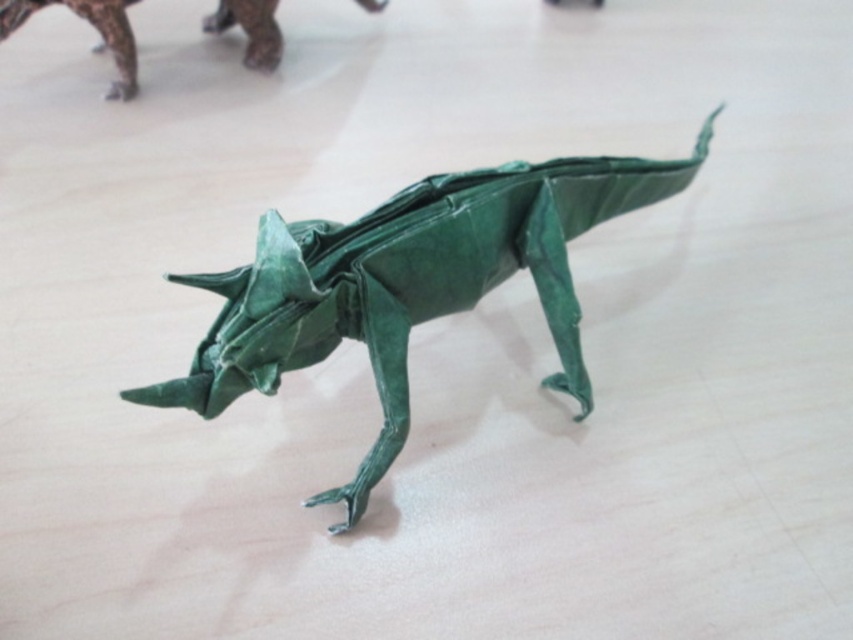
Question: Among these objects, which one is nearest to the camera?

Choices:
 (A) green paper dinosaur at upper left
 (B) green paper origami dinosaur at center

Answer: (B)

Question: Is green paper origami dinosaur at center closer to the viewer compared to green paper dinosaur at upper left?

Choices:
 (A) no
 (B) yes

Answer: (B)

Question: Which object is farther from the camera taking this photo?

Choices:
 (A) green paper origami dinosaur at center
 (B) green paper dinosaur at upper left

Answer: (B)

Question: Where is green paper origami dinosaur at center located in relation to green paper dinosaur at upper left in the image?

Choices:
 (A) below
 (B) above

Answer: (A)

Question: Does green paper origami dinosaur at center appear under green paper dinosaur at upper left?

Choices:
 (A) no
 (B) yes

Answer: (B)